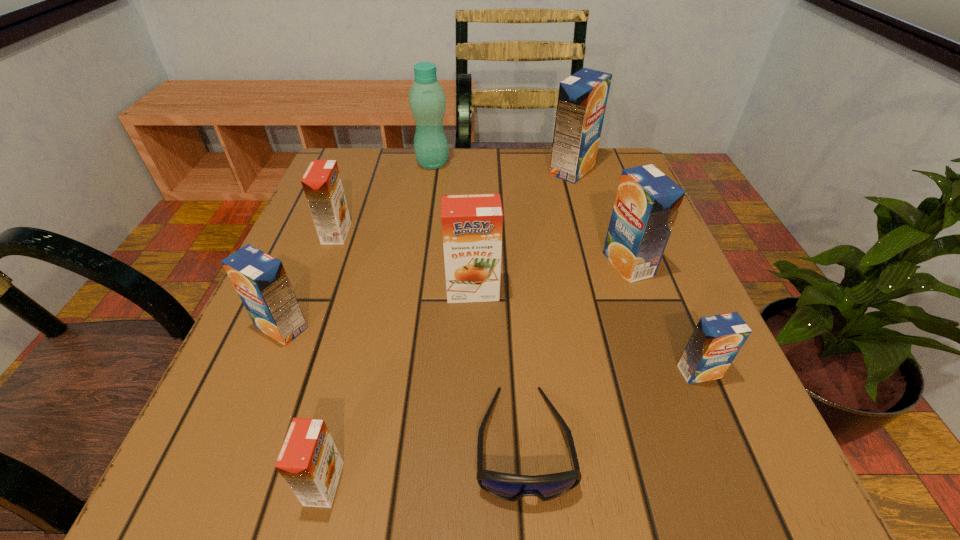
Locate an element on the screen. The width and height of the screenshot is (960, 540). free location located 0.370m on the back of the third farthest blue orange_juice is located at coordinates (340, 188).

In order to click on free location located on the right of the second smallest orange orange juice in this screenshot , I will do `click(472, 233)`.

At what (x,y) coordinates should I click in order to perform the action: click on vacant space situated 0.230m on the back of the seventh farthest object. Please return your answer as a coordinate pair (x, y). The height and width of the screenshot is (540, 960). Looking at the image, I should click on (652, 259).

This screenshot has width=960, height=540. Find the location of `free spot located 0.310m on the right of the third object from left to right`. free spot located 0.310m on the right of the third object from left to right is located at coordinates (595, 484).

Identify the location of bottle that is positioned at the far edge. This screenshot has width=960, height=540. (427, 100).

I want to click on orange_juice that is positioned at the far edge, so click(x=582, y=99).

Find the location of a particular element. Image resolution: width=960 pixels, height=540 pixels. orange juice present at the near edge is located at coordinates (309, 461).

This screenshot has height=540, width=960. Identify the location of sunglasses that is positioned at the near edge. (512, 487).

At what (x,y) coordinates should I click in order to perform the action: click on object at the near left corner. Please return your answer as a coordinate pair (x, y). This screenshot has height=540, width=960. Looking at the image, I should click on (309, 461).

Locate an element on the screen. The height and width of the screenshot is (540, 960). object that is positioned at the far right corner is located at coordinates (582, 99).